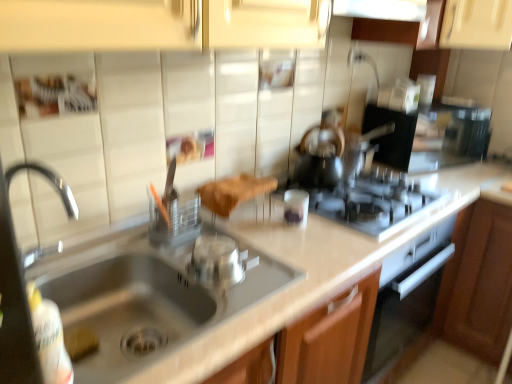
Identify the location of vacant point to the right of transparent glass candle at center, acting as the 1th appliance starting from the back. (351, 226).